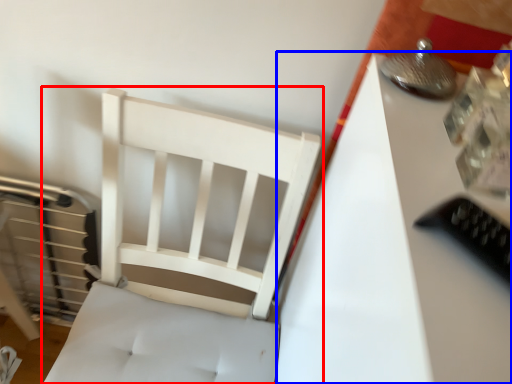
Question: Which point is closer to the camera, furniture (highlighted by a red box) or table (highlighted by a blue box)?

Choices:
 (A) furniture
 (B) table

Answer: (B)